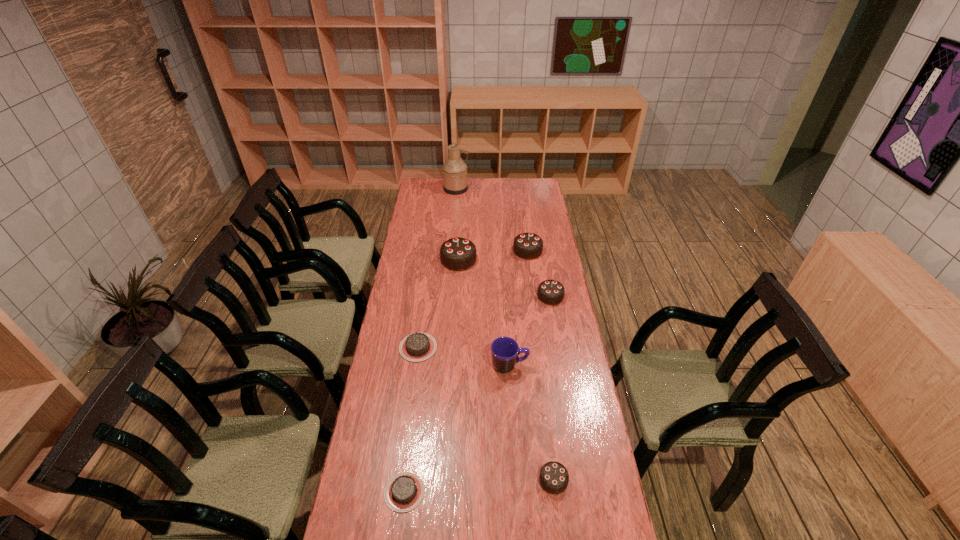
This screenshot has height=540, width=960. I want to click on the farthest object, so click(454, 171).

This screenshot has width=960, height=540. Find the location of `the tallest object`. the tallest object is located at coordinates (454, 171).

Find the location of `the biggest chocolate chocolate cake`. the biggest chocolate chocolate cake is located at coordinates (458, 254).

The height and width of the screenshot is (540, 960). Identify the location of the leftmost chocolate chocolate cake. (458, 254).

The image size is (960, 540). I want to click on the fifth shortest chocolate cake, so pos(528,246).

At what (x,y) coordinates should I click in order to perform the action: click on mug. Please return your answer as a coordinate pair (x, y). Looking at the image, I should click on (505, 351).

Find the location of a particular element. The width and height of the screenshot is (960, 540). the third farthest chocolate chocolate cake is located at coordinates (551, 292).

The width and height of the screenshot is (960, 540). In order to click on the second smallest chocolate chocolate cake in this screenshot , I will do `click(551, 292)`.

Find the location of a particular element. This screenshot has width=960, height=540. the nearest chocolate chocolate cake is located at coordinates (553, 477).

The width and height of the screenshot is (960, 540). I want to click on the smallest chocolate chocolate cake, so click(553, 477).